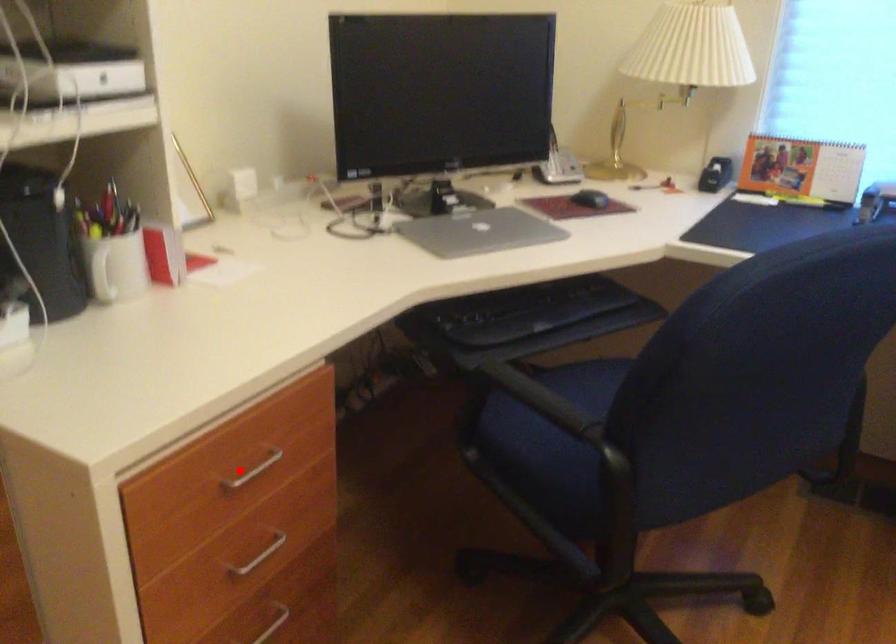
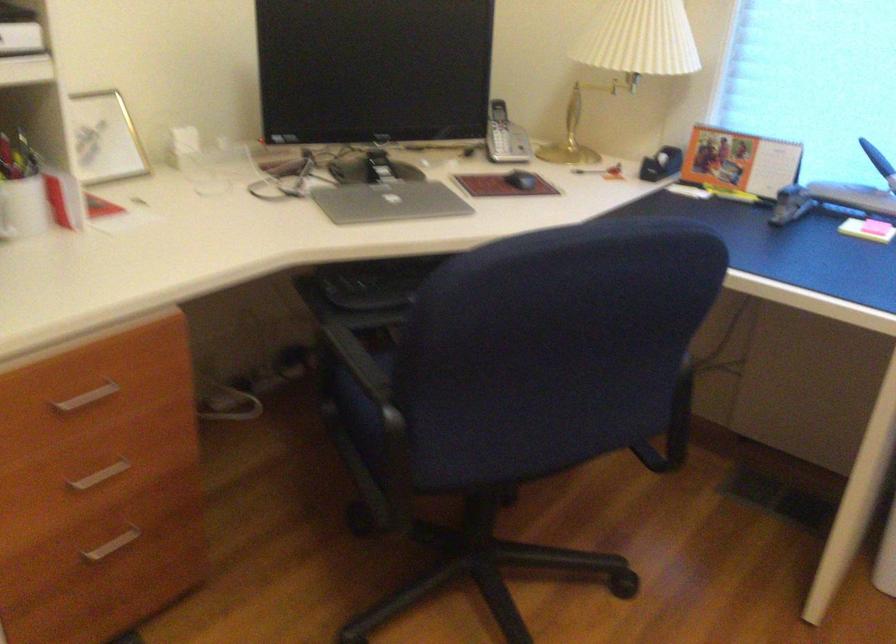
Question: I am providing you with two images of the same scene from different viewpoints. Image1 has a red point marked. In image2, the corresponding 3D location appears at what relative position? Reply with the corresponding letter.

Choices:
 (A) Closer
 (B) Farther

Answer: (B)